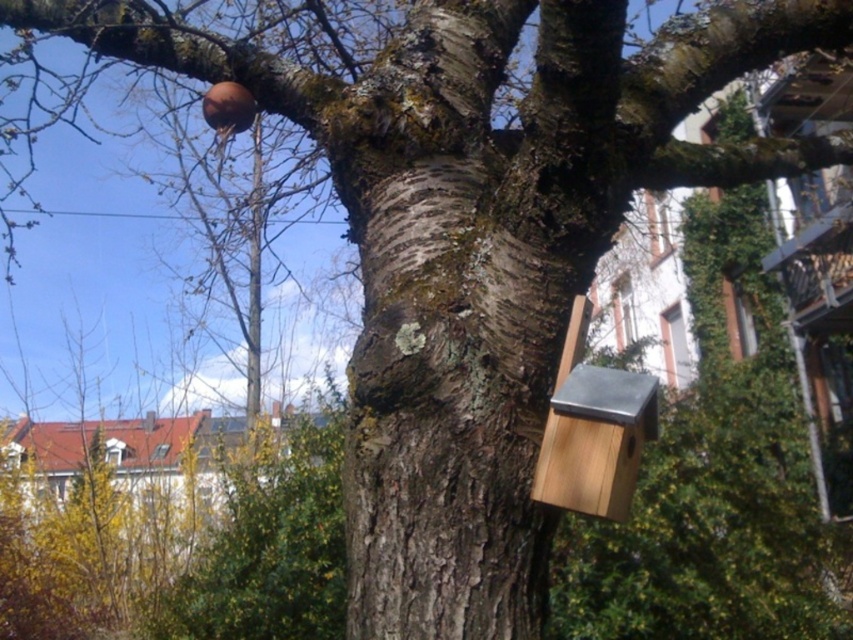
Question: From the image, what is the correct spatial relationship of smooth bark tree trunk at center in relation to wooden birdhouse at right?

Choices:
 (A) above
 (B) below

Answer: (A)

Question: Is smooth bark tree trunk at center below wooden birdhouse at right?

Choices:
 (A) yes
 (B) no

Answer: (B)

Question: Among these points, which one is farthest from the camera?

Choices:
 (A) (389, 566)
 (B) (618, 401)

Answer: (A)

Question: Can you confirm if smooth bark tree trunk at center is positioned above wooden birdhouse at right?

Choices:
 (A) no
 (B) yes

Answer: (B)

Question: Which point is farther to the camera?

Choices:
 (A) smooth bark tree trunk at center
 (B) wooden birdhouse at right

Answer: (A)